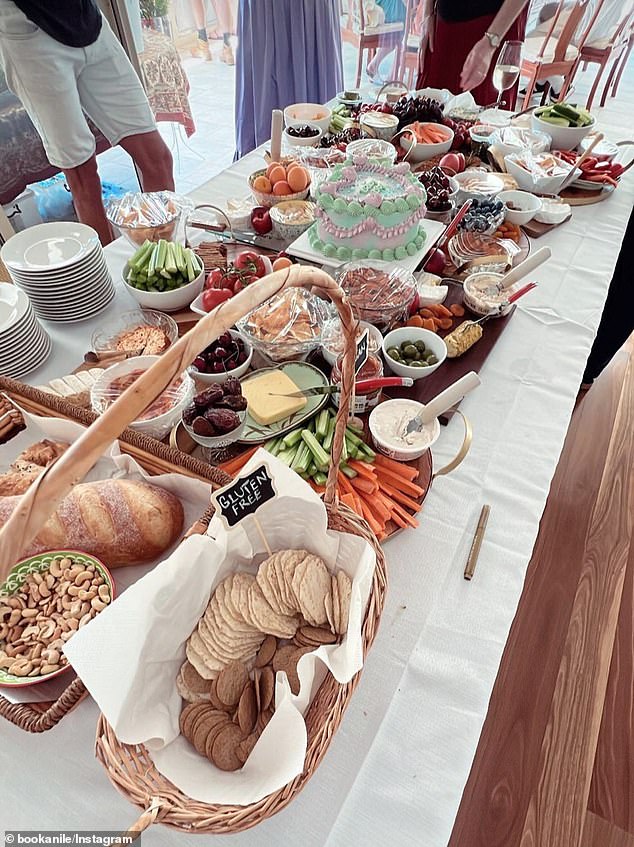
At what (x,y) coordinates should I click in order to perform the action: click on basket wicker. Please return your answer as a coordinate pair (x, y). Looking at the image, I should click on (149, 798).